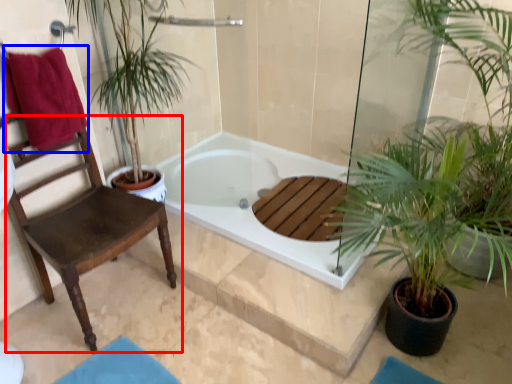
Question: Which object appears closest to the camera in this image, chair (highlighted by a red box) or beach towel (highlighted by a blue box)?

Choices:
 (A) chair
 (B) beach towel

Answer: (A)